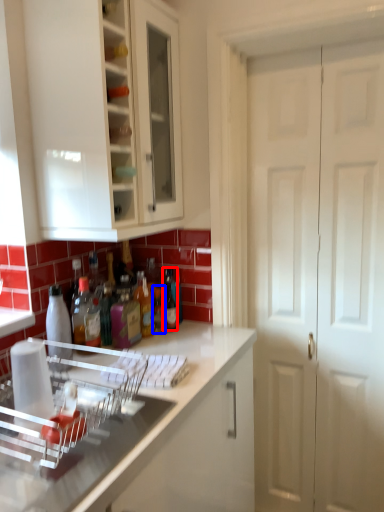
Question: Which of the following is the closest to the observer, bottle (highlighted by a red box) or bottle (highlighted by a blue box)?

Choices:
 (A) bottle
 (B) bottle

Answer: (A)